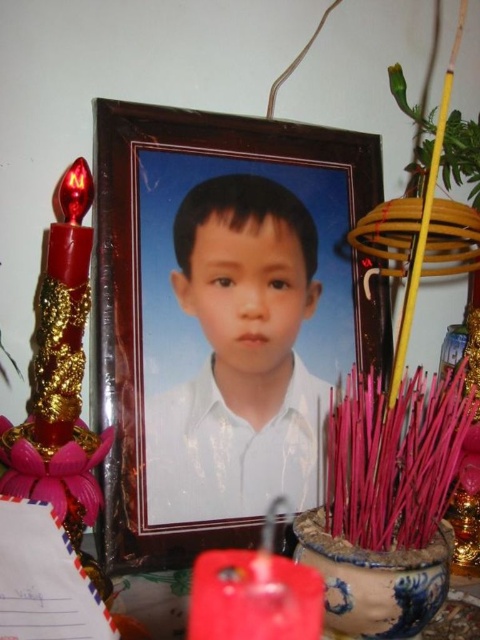
Question: From the image, what is the correct spatial relationship of blue ceramic pot at center in relation to matte red candle at lower center?

Choices:
 (A) left
 (B) right

Answer: (B)

Question: Which object is positioned closest to the blue ceramic pot at center?

Choices:
 (A) matte red candle at lower center
 (B) wooden frame at center
 (C) white glossy shirt at center
 (D) shiny gold candle at left

Answer: (A)

Question: Which object is the farthest from the wooden frame at center?

Choices:
 (A) shiny gold candle at left
 (B) blue ceramic pot at center

Answer: (B)

Question: Estimate the real-world distances between objects in this image. Which object is closer to the white glossy shirt at center?

Choices:
 (A) wooden frame at center
 (B) blue ceramic pot at center

Answer: (A)

Question: Can you confirm if wooden frame at center is positioned to the right of white glossy shirt at center?

Choices:
 (A) no
 (B) yes

Answer: (A)

Question: Can you confirm if wooden frame at center is wider than shiny gold candle at left?

Choices:
 (A) no
 (B) yes

Answer: (B)